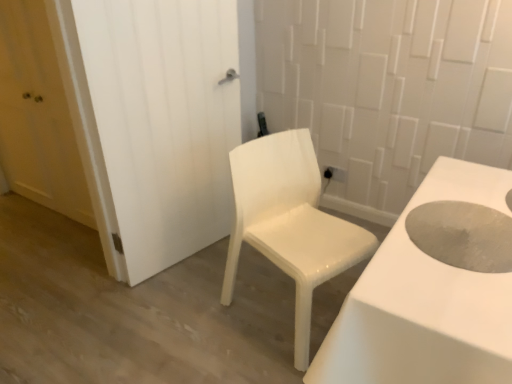
Where is `free space in front of matte white door at left, which ranks as the 2th door in right-to-left order`? This screenshot has width=512, height=384. free space in front of matte white door at left, which ranks as the 2th door in right-to-left order is located at coordinates (46, 256).